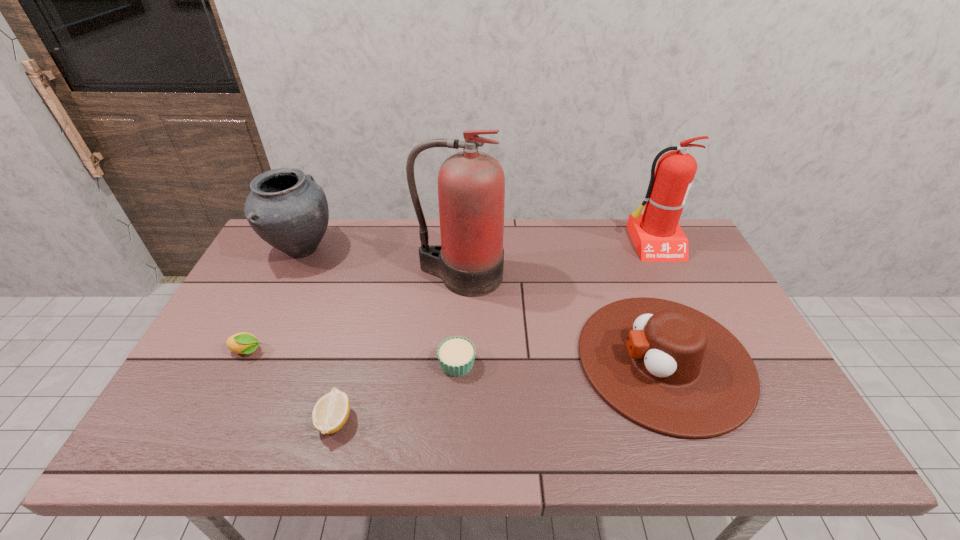
Image resolution: width=960 pixels, height=540 pixels. I want to click on urn that is positioned at the far edge, so click(x=286, y=208).

Where is `cowboy hat at the near edge`? cowboy hat at the near edge is located at coordinates (670, 368).

At what (x,y) coordinates should I click in order to perform the action: click on lemon positioned at the near edge. Please return your answer as a coordinate pair (x, y). Looking at the image, I should click on (330, 413).

You are a GUI agent. You are given a task and a screenshot of the screen. Output one action in this format:
    pyautogui.click(x=<x>, y=<y>)
    Task: Click on the urn that is at the left edge
    
    Given the screenshot: What is the action you would take?
    pyautogui.click(x=286, y=208)

Where is `lemon present at the left edge`? This screenshot has height=540, width=960. lemon present at the left edge is located at coordinates (242, 343).

The height and width of the screenshot is (540, 960). Find the location of `fire extinguisher at the right edge`. fire extinguisher at the right edge is located at coordinates (656, 234).

The height and width of the screenshot is (540, 960). In order to click on cowboy hat at the right edge in this screenshot , I will do `click(670, 368)`.

Locate an element on the screen. object situated at the far left corner is located at coordinates (286, 208).

Identify the location of object located at the far right corner. The image size is (960, 540). (656, 234).

Where is `object positioned at the near right corner`? The height and width of the screenshot is (540, 960). object positioned at the near right corner is located at coordinates (670, 368).